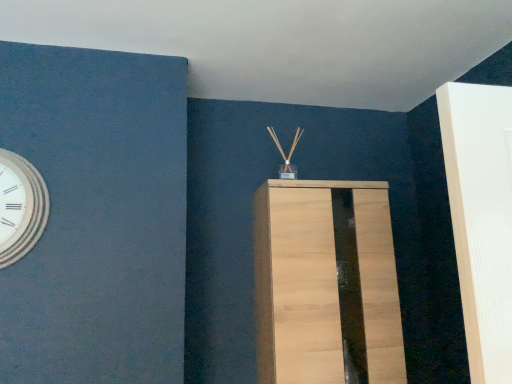
What do you see at coordinates (20, 207) in the screenshot? I see `white wooden wall clock at left` at bounding box center [20, 207].

At what (x,y) coordinates should I click in order to perform the action: click on white wooden wall clock at left. Please return your answer as a coordinate pair (x, y). The height and width of the screenshot is (384, 512). Looking at the image, I should click on (20, 207).

The image size is (512, 384). Describe the element at coordinates (326, 284) in the screenshot. I see `light wood cabinet at center` at that location.

What is the approximate height of light wood cabinet at center?

It is 33.10 inches.

Image resolution: width=512 pixels, height=384 pixels. Identify the location of light wood cabinet at center. (326, 284).

This screenshot has width=512, height=384. In order to click on white wooden wall clock at left in this screenshot , I will do `click(20, 207)`.

Is white wooden wall clock at left at the left side of light wood cabinet at center?

Yes.

Is white wooden wall clock at left further to camera compared to light wood cabinet at center?

That is False.

Does point (22, 219) come behind point (365, 213)?

That is False.

From the image's perspective, is white wooden wall clock at left above or below light wood cabinet at center?

Clearly, from the image's perspective, white wooden wall clock at left is above light wood cabinet at center.

From a real-world perspective, is white wooden wall clock at left physically below light wood cabinet at center?

Actually, white wooden wall clock at left is physically above light wood cabinet at center in the real world.

Between white wooden wall clock at left and light wood cabinet at center, which one has smaller width?

white wooden wall clock at left.

Considering the sizes of objects white wooden wall clock at left and light wood cabinet at center in the image provided, who is shorter, white wooden wall clock at left or light wood cabinet at center?

white wooden wall clock at left.

Is white wooden wall clock at left smaller than light wood cabinet at center?

Indeed, white wooden wall clock at left has a smaller size compared to light wood cabinet at center.

Is white wooden wall clock at left not within light wood cabinet at center?

Yes, white wooden wall clock at left is outside of light wood cabinet at center.

Is white wooden wall clock at left with light wood cabinet at center?

They are not placed beside each other.

Could you tell me if white wooden wall clock at left is facing light wood cabinet at center?

No, white wooden wall clock at left is not facing towards light wood cabinet at center.

Measure the distance from white wooden wall clock at left to light wood cabinet at center.

white wooden wall clock at left is 38.95 inches away from light wood cabinet at center.

Image resolution: width=512 pixels, height=384 pixels. I want to click on furniture behind the white wooden wall clock at left, so click(x=326, y=284).

In the image, is light wood cabinet at center on the left side or the right side of white wooden wall clock at left?

Based on their positions, light wood cabinet at center is located to the right of white wooden wall clock at left.

Between light wood cabinet at center and white wooden wall clock at left, which one is positioned behind?

light wood cabinet at center is more distant.

Is point (394, 258) farther from viewer compared to point (20, 251)?

Yes, point (394, 258) is behind point (20, 251).

From the image's perspective, who appears lower, light wood cabinet at center or white wooden wall clock at left?

light wood cabinet at center, from the image's perspective.

From a real-world perspective, is light wood cabinet at center beneath white wooden wall clock at left?

Yes, from a real-world perspective, light wood cabinet at center is beneath white wooden wall clock at left.

From the picture: Considering the relative sizes of light wood cabinet at center and white wooden wall clock at left in the image provided, is light wood cabinet at center wider than white wooden wall clock at left?

Correct, the width of light wood cabinet at center exceeds that of white wooden wall clock at left.

Considering the relative sizes of light wood cabinet at center and white wooden wall clock at left in the image provided, is light wood cabinet at center shorter than white wooden wall clock at left?

Incorrect, the height of light wood cabinet at center does not fall short of that of white wooden wall clock at left.

Considering the relative sizes of light wood cabinet at center and white wooden wall clock at left in the image provided, is light wood cabinet at center bigger than white wooden wall clock at left?

Indeed, light wood cabinet at center has a larger size compared to white wooden wall clock at left.

Is light wood cabinet at center not within white wooden wall clock at left?

light wood cabinet at center lies outside white wooden wall clock at left's area.

Does light wood cabinet at center touch white wooden wall clock at left?

No.

Does light wood cabinet at center turn towards white wooden wall clock at left?

No, light wood cabinet at center does not turn towards white wooden wall clock at left.

Image resolution: width=512 pixels, height=384 pixels. Find the location of `furniture behind the white wooden wall clock at left`. furniture behind the white wooden wall clock at left is located at coordinates (326, 284).

The height and width of the screenshot is (384, 512). I want to click on wall clock in front of the light wood cabinet at center, so click(x=20, y=207).

I want to click on furniture behind the white wooden wall clock at left, so click(x=326, y=284).